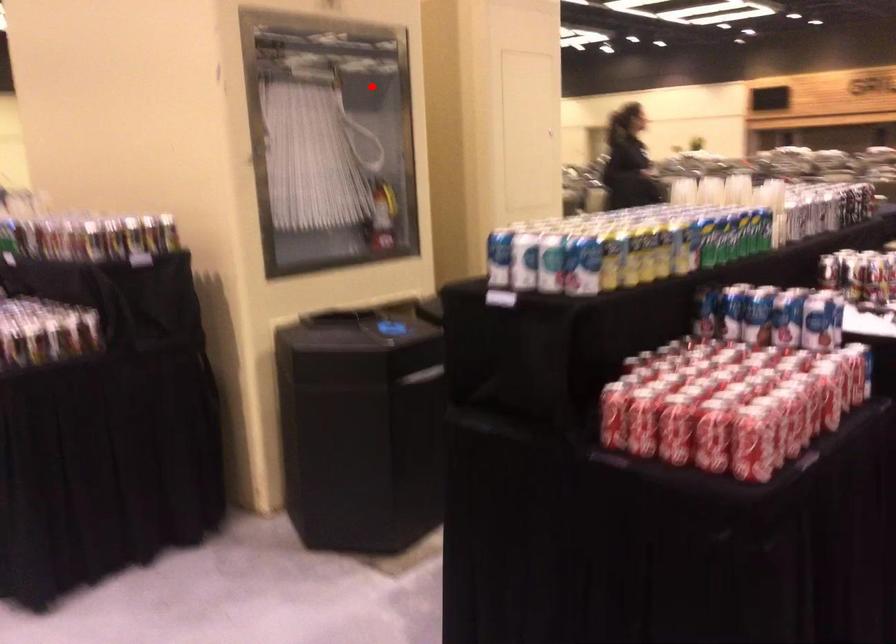
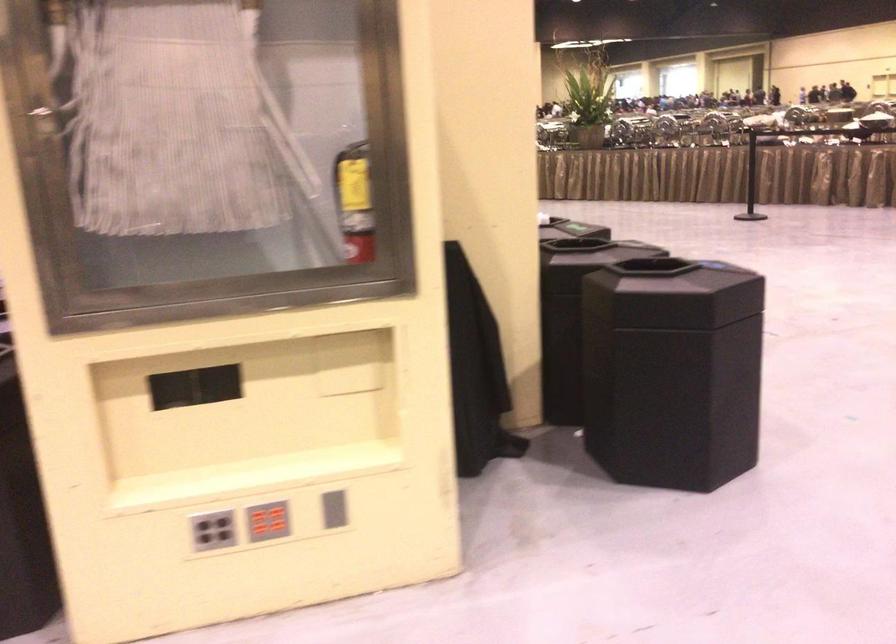
Question: I am providing you with two images of the same scene from different viewpoints. A red point is marked on the first image. Can you still see the location of the red point in image 2?

Choices:
 (A) Yes
 (B) No

Answer: (B)